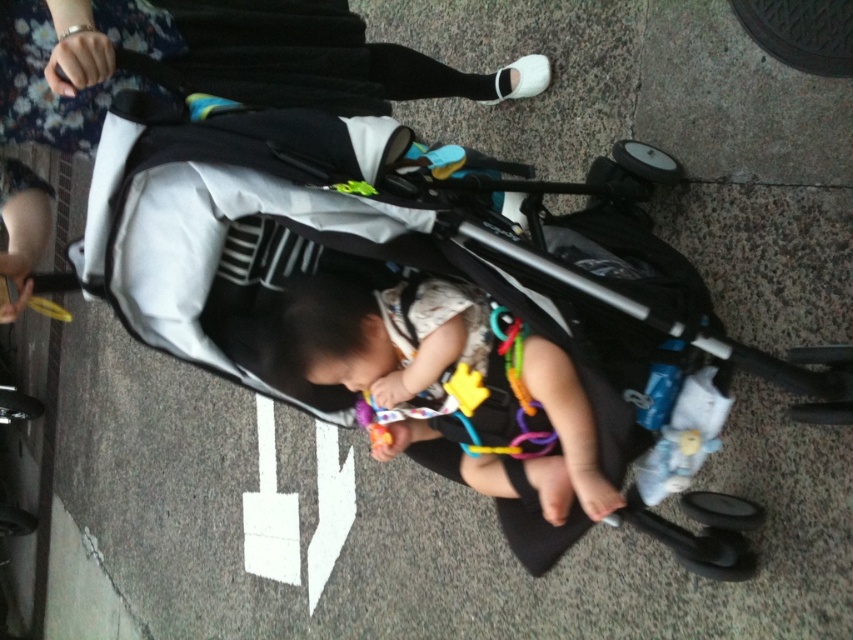
Question: Which point is farther from the camera taking this photo?

Choices:
 (A) (553, 397)
 (B) (303, 74)

Answer: (B)

Question: Observing the image, what is the correct spatial positioning of white fabric stroller at center in reference to soft white fabric baby at center?

Choices:
 (A) below
 (B) above

Answer: (B)

Question: Considering the real-world distances, which object is farthest from the soft white fabric baby at center?

Choices:
 (A) white fabric stroller at center
 (B) black fabric baby carriage at center

Answer: (A)

Question: Which of the following is the closest to the observer?

Choices:
 (A) (364, 60)
 (B) (547, 513)
 (C) (206, 356)

Answer: (C)

Question: Is white fabric stroller at center to the right of soft white fabric baby at center from the viewer's perspective?

Choices:
 (A) no
 (B) yes

Answer: (A)

Question: Does black fabric baby carriage at center appear over white fabric stroller at center?

Choices:
 (A) yes
 (B) no

Answer: (B)